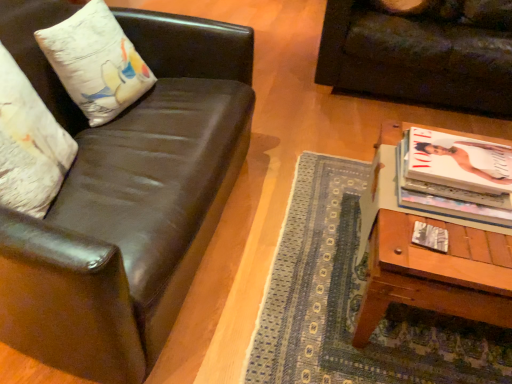
This screenshot has height=384, width=512. Find the location of `blank space above white glossy magazine at right (from a real-world perspective)`. blank space above white glossy magazine at right (from a real-world perspective) is located at coordinates (469, 166).